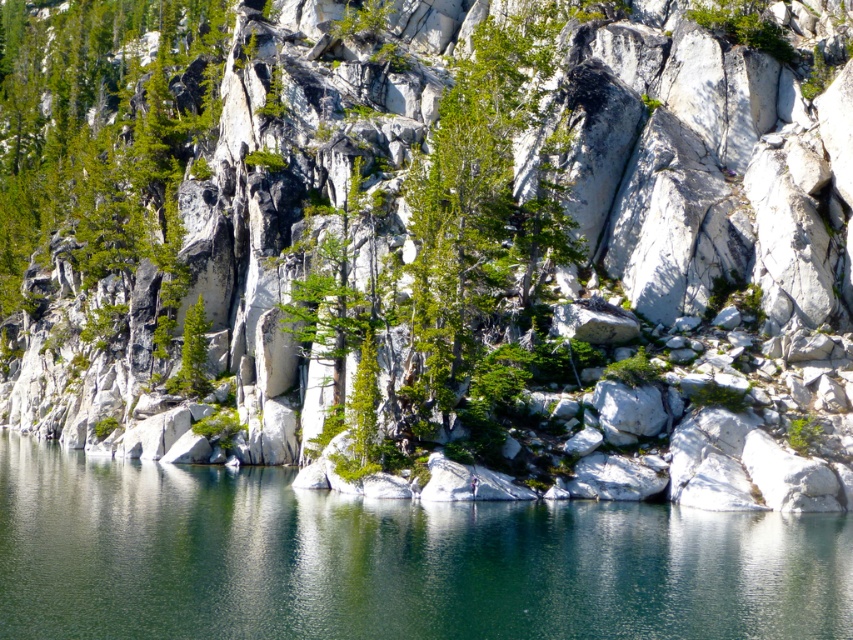
Question: In this image, where is green marble water at center located relative to green leafy tree at center?

Choices:
 (A) right
 (B) left

Answer: (B)

Question: Can you confirm if green marble water at center is positioned below green leafy tree at center?

Choices:
 (A) no
 (B) yes

Answer: (B)

Question: Which point is closer to the camera?

Choices:
 (A) green marble water at center
 (B) green leafy tree at center

Answer: (A)

Question: Among these points, which one is farthest from the camera?

Choices:
 (A) (134, 525)
 (B) (440, 380)

Answer: (B)

Question: Does green marble water at center have a greater width compared to green leafy tree at center?

Choices:
 (A) no
 (B) yes

Answer: (B)